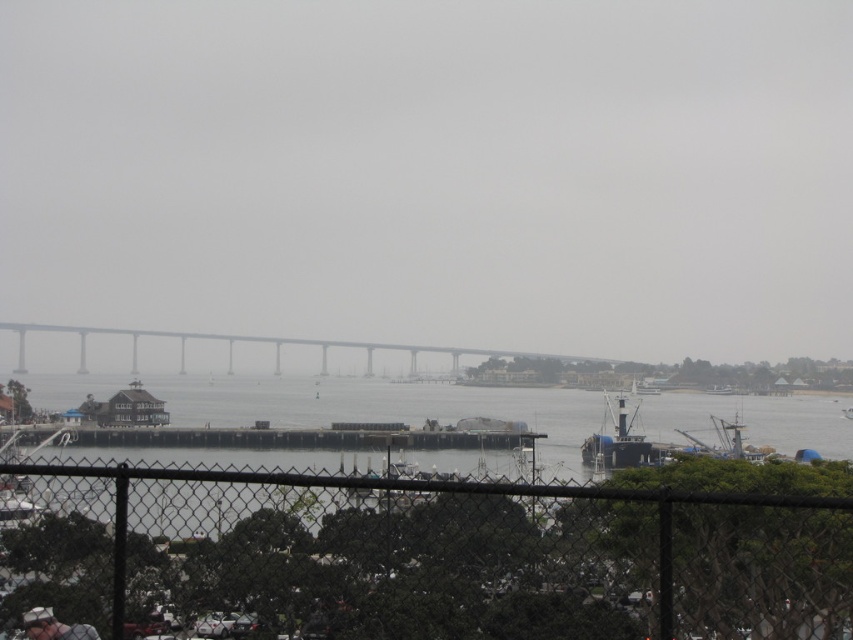
Does black chain-link fence at lower center have a lesser width compared to clear water at lower center?

Yes, black chain-link fence at lower center is thinner than clear water at lower center.

Who is higher up, black chain-link fence at lower center or clear water at lower center?

Positioned higher is black chain-link fence at lower center.

The width and height of the screenshot is (853, 640). Describe the element at coordinates (418, 557) in the screenshot. I see `black chain-link fence at lower center` at that location.

This screenshot has width=853, height=640. Identify the location of black chain-link fence at lower center. (418, 557).

The height and width of the screenshot is (640, 853). What do you see at coordinates (381, 406) in the screenshot? I see `clear water at lower center` at bounding box center [381, 406].

Who is positioned more to the left, clear water at lower center or white plastic boat at center?

clear water at lower center is more to the left.

Between point (283, 458) and point (635, 384), which one is positioned in front?

Positioned in front is point (283, 458).

Where is `clear water at lower center`? The height and width of the screenshot is (640, 853). clear water at lower center is located at coordinates point(381,406).

Does clear water at lower center have a greater width compared to white matte hat at lower left?

Yes, clear water at lower center is wider than white matte hat at lower left.

From the picture: Can you confirm if clear water at lower center is taller than white matte hat at lower left?

Indeed, clear water at lower center has a greater height compared to white matte hat at lower left.

Locate an element on the screen. clear water at lower center is located at coordinates (381, 406).